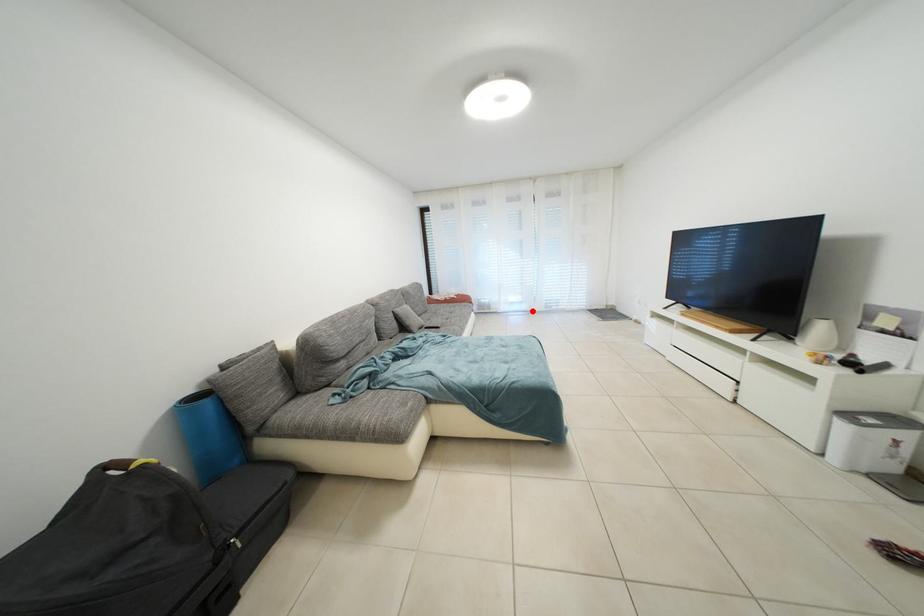
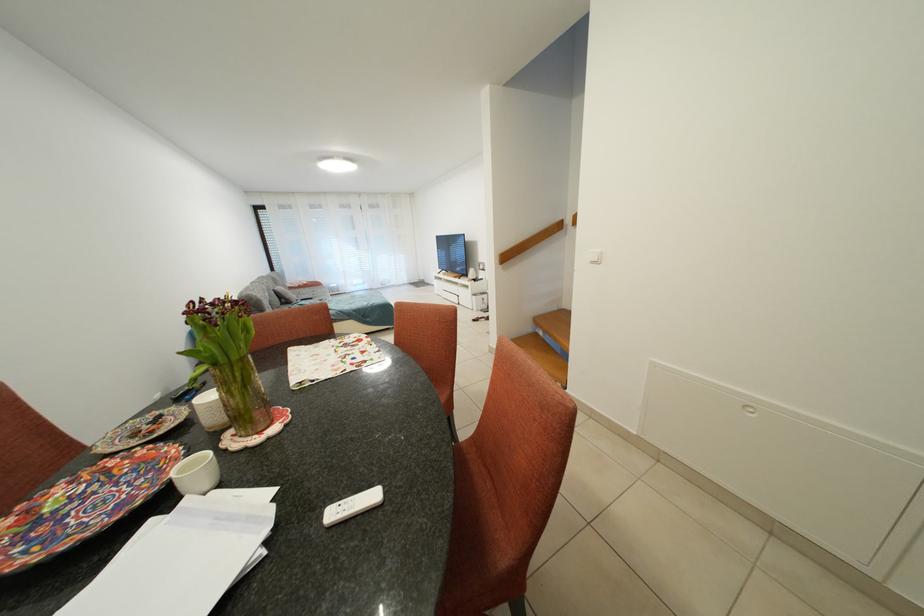
Question: I am providing you with two images of the same scene from different viewpoints. In image1, a red point is highlighted. Considering the same 3D point in image2, which of the following is correct?

Choices:
 (A) It is closer
 (B) It is farther

Answer: (A)